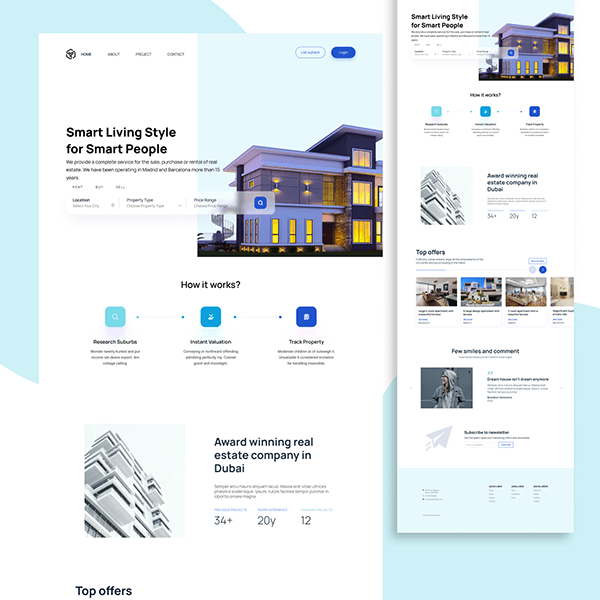
I want to click on staircase, so click(227, 229).